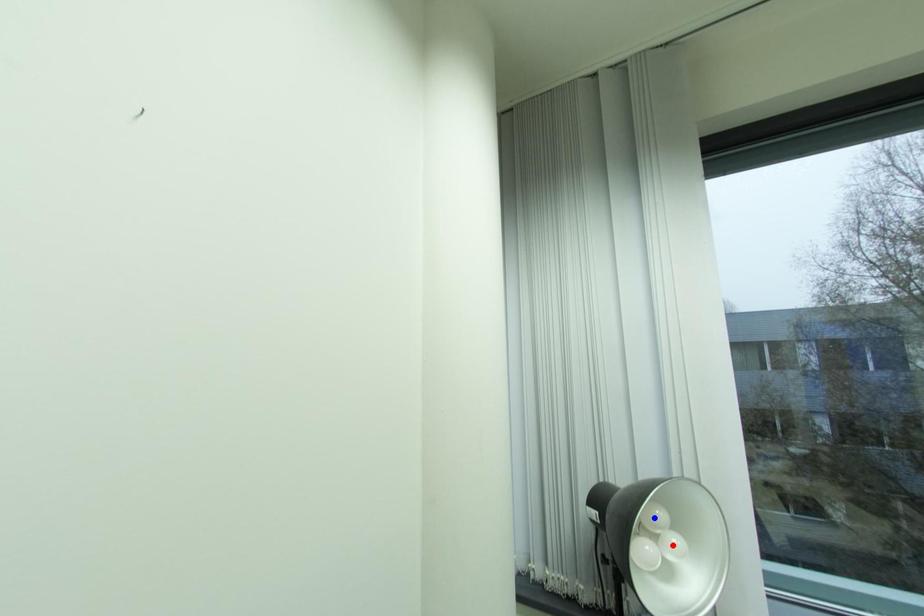
Question: Two points are marked on the image. Which point is closer to the camera?

Choices:
 (A) Blue point is closer.
 (B) Red point is closer.

Answer: (A)